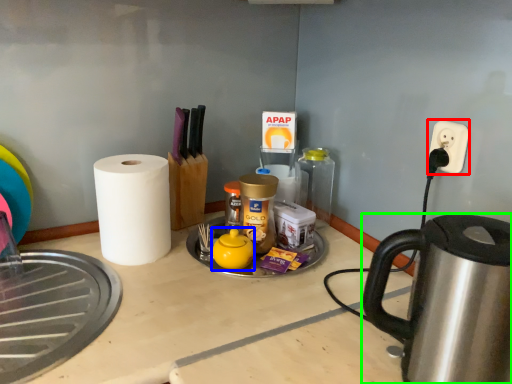
Question: Estimate the real-world distances between objects in this image. Which object is farther from electric outlet (highlighted by a red box), tea pot (highlighted by a blue box) or kettle (highlighted by a green box)?

Choices:
 (A) tea pot
 (B) kettle

Answer: (A)